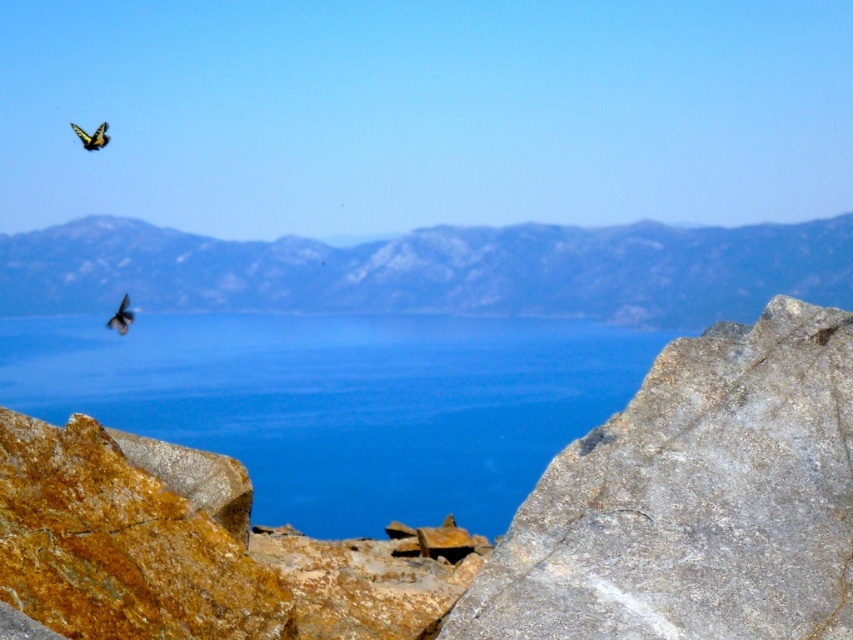
Question: Considering the relative positions of blue water at center and shiny black bird at upper left in the image provided, where is blue water at center located with respect to shiny black bird at upper left?

Choices:
 (A) below
 (B) above

Answer: (A)

Question: Which object is the closest to the shiny black bird at upper left?

Choices:
 (A) blue water at center
 (B) yellow patterned butterfly at upper left
 (C) gray rocky mountain at center
 (D) gray/rough rock at center-right

Answer: (A)

Question: From the image, what is the correct spatial relationship of gray rocky mountain at center in relation to yellow patterned butterfly at upper left?

Choices:
 (A) above
 (B) below

Answer: (B)

Question: Is gray/rough rock at center-right in front of gray rocky mountain at center?

Choices:
 (A) yes
 (B) no

Answer: (A)

Question: Which object is positioned farthest from the gray rocky mountain at center?

Choices:
 (A) blue water at center
 (B) shiny black bird at upper left
 (C) gray/rough rock at center-right

Answer: (C)

Question: Among these points, which one is nearest to the camera?

Choices:
 (A) (743, 317)
 (B) (122, 356)
 (C) (637, 401)

Answer: (C)